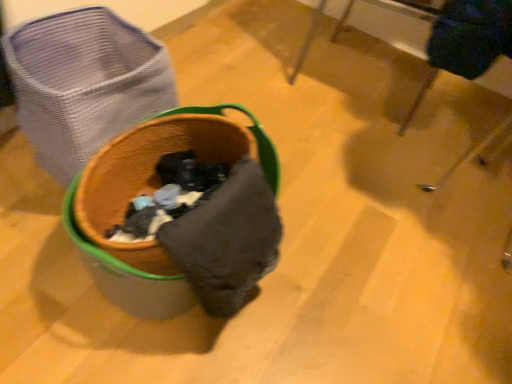
Question: Is the surface of rattan laundry basket at left in direct contact with wooden table at upper center?

Choices:
 (A) yes
 (B) no

Answer: (B)

Question: Is rattan laundry basket at left not near wooden table at upper center?

Choices:
 (A) yes
 (B) no

Answer: (B)

Question: Is rattan laundry basket at left facing away from wooden table at upper center?

Choices:
 (A) no
 (B) yes

Answer: (A)

Question: Is rattan laundry basket at left positioned beyond the bounds of wooden table at upper center?

Choices:
 (A) no
 (B) yes

Answer: (B)

Question: Is wooden table at upper center inside rattan laundry basket at left?

Choices:
 (A) yes
 (B) no

Answer: (B)

Question: From a real-world perspective, is rattan laundry basket at left positioned over wooden table at upper center based on gravity?

Choices:
 (A) yes
 (B) no

Answer: (B)

Question: Is wooden table at upper center bigger than rattan laundry basket at left?

Choices:
 (A) no
 (B) yes

Answer: (B)

Question: Does wooden table at upper center have a smaller size compared to rattan laundry basket at left?

Choices:
 (A) yes
 (B) no

Answer: (B)

Question: Are wooden table at upper center and rattan laundry basket at left far apart?

Choices:
 (A) no
 (B) yes

Answer: (A)

Question: Does wooden table at upper center have a greater width compared to rattan laundry basket at left?

Choices:
 (A) no
 (B) yes

Answer: (B)

Question: Is wooden table at upper center aimed at rattan laundry basket at left?

Choices:
 (A) yes
 (B) no

Answer: (A)

Question: Is wooden table at upper center at the right side of rattan laundry basket at left?

Choices:
 (A) no
 (B) yes

Answer: (B)

Question: Is wooden table at upper center inside the boundaries of rattan laundry basket at left, or outside?

Choices:
 (A) inside
 (B) outside

Answer: (B)